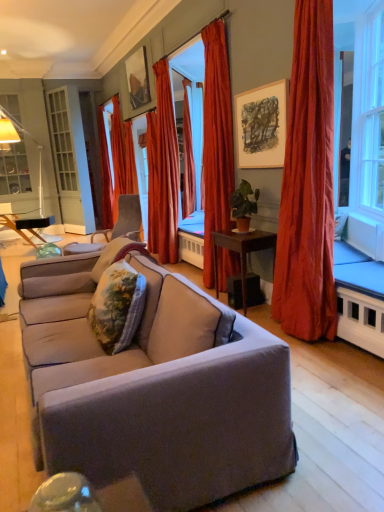
Question: Is velvet gray chair at center looking in the opposite direction of satin red curtain at center, which ranks as the 4th curtain in back-to-front order?

Choices:
 (A) yes
 (B) no

Answer: (B)

Question: Does velvet gray chair at center appear on the left side of satin red curtain at center, arranged as the second curtain when viewed from the front?

Choices:
 (A) yes
 (B) no

Answer: (A)

Question: Can you confirm if velvet gray chair at center is bigger than satin red curtain at center, which ranks as the second curtain in right-to-left order?

Choices:
 (A) no
 (B) yes

Answer: (A)

Question: Can we say velvet gray chair at center lies outside satin red curtain at center, arranged as the second curtain when viewed from the front?

Choices:
 (A) yes
 (B) no

Answer: (A)

Question: Considering the relative positions of velvet gray chair at center and satin red curtain at center, which is the fourth curtain from left to right, in the image provided, is velvet gray chair at center to the right of satin red curtain at center, which is the fourth curtain from left to right, from the viewer's perspective?

Choices:
 (A) no
 (B) yes

Answer: (A)

Question: Considering the positions of satin red curtain at right, which is counted as the 1th curtain, starting from the front, and floral fabric pillow at center, which is counted as the second pillow, starting from the back, in the image, is satin red curtain at right, which is counted as the 1th curtain, starting from the front, taller or shorter than floral fabric pillow at center, which is counted as the second pillow, starting from the back,?

Choices:
 (A) tall
 (B) short

Answer: (A)

Question: In terms of width, does satin red curtain at right, which ranks as the fifth curtain in back-to-front order, look wider or thinner when compared to floral fabric pillow at center, which is counted as the second pillow, starting from the back?

Choices:
 (A) thin
 (B) wide

Answer: (B)

Question: In terms of size, does satin red curtain at right, which is counted as the 1th curtain, starting from the front, appear bigger or smaller than floral fabric pillow at center, which is counted as the first pillow, starting from the front?

Choices:
 (A) big
 (B) small

Answer: (A)

Question: From a real-world perspective, is satin red curtain at right, the first curtain positioned from the right, above or below floral fabric pillow at center, which is counted as the first pillow, starting from the front?

Choices:
 (A) above
 (B) below

Answer: (A)

Question: From the image's perspective, is matte wooden picture frame at upper center, arranged as the 1th picture frame when ordered from the bottom, above or below wooden table at left, which ranks as the 2th table in front-to-back order?

Choices:
 (A) below
 (B) above

Answer: (B)

Question: In terms of width, does matte wooden picture frame at upper center, which is counted as the 2th picture frame, starting from the back, look wider or thinner when compared to wooden table at left, which is the second table in right-to-left order?

Choices:
 (A) thin
 (B) wide

Answer: (A)

Question: Would you say matte wooden picture frame at upper center, marked as the first picture frame in a right-to-left arrangement, is to the left or to the right of wooden table at left, which ranks as the 2th table in front-to-back order, in the picture?

Choices:
 (A) right
 (B) left

Answer: (A)

Question: From their relative heights in the image, would you say matte wooden picture frame at upper center, the 1th picture frame from the front, is taller or shorter than wooden table at left, the first table from the back?

Choices:
 (A) short
 (B) tall

Answer: (A)

Question: From a real-world perspective, relative to silky orange curtain at center, the third curtain in the back-to-front sequence, is matte wooden picture frame at upper center, which ranks as the 2th picture frame in top-to-bottom order, vertically above or below?

Choices:
 (A) below
 (B) above

Answer: (B)

Question: Would you say matte wooden picture frame at upper center, marked as the first picture frame in a right-to-left arrangement, is to the left or to the right of silky orange curtain at center, the 3th curtain from the left, in the picture?

Choices:
 (A) left
 (B) right

Answer: (B)